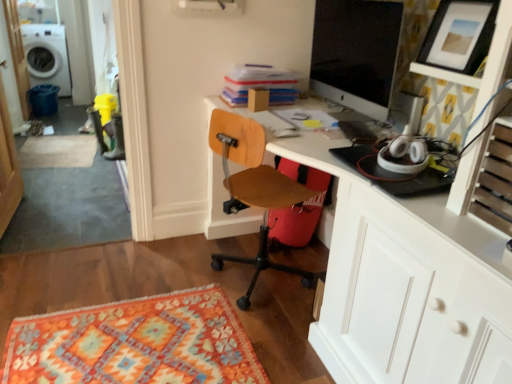
The height and width of the screenshot is (384, 512). I want to click on free spot behind transparent glass door at left, marked as the second glass door in a top-to-bottom arrangement, so click(x=61, y=189).